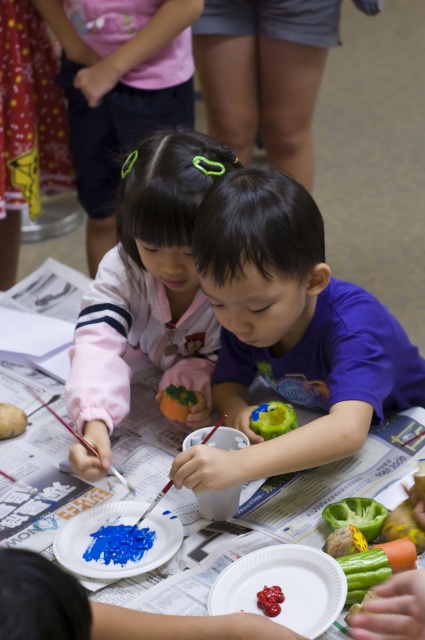
Question: Is pink fabric hair tie at upper center above blue matte paint at lower center?

Choices:
 (A) no
 (B) yes

Answer: (B)

Question: Which of the following is the closest to the observer?

Choices:
 (A) green matte bell pepper at lower right
 (B) white paper plate at center

Answer: (B)

Question: Is blue matte paint at lower center bigger than green matte pepper at center?

Choices:
 (A) yes
 (B) no

Answer: (B)

Question: Among these points, which one is nearest to the camera?

Choices:
 (A) (317, 628)
 (B) (113, 506)
 (C) (78, 88)
 (D) (379, 356)

Answer: (A)

Question: Considering the real-world distances, which object is farthest from the white paper plate at center?

Choices:
 (A) blue matte paint at lower center
 (B) green matte bell pepper at lower right
 (C) green matte pepper at lower center
 (D) pink fabric hair tie at upper center

Answer: (D)

Question: Is purple matte shirt at center to the right of matte white paper plate at lower center from the viewer's perspective?

Choices:
 (A) yes
 (B) no

Answer: (A)